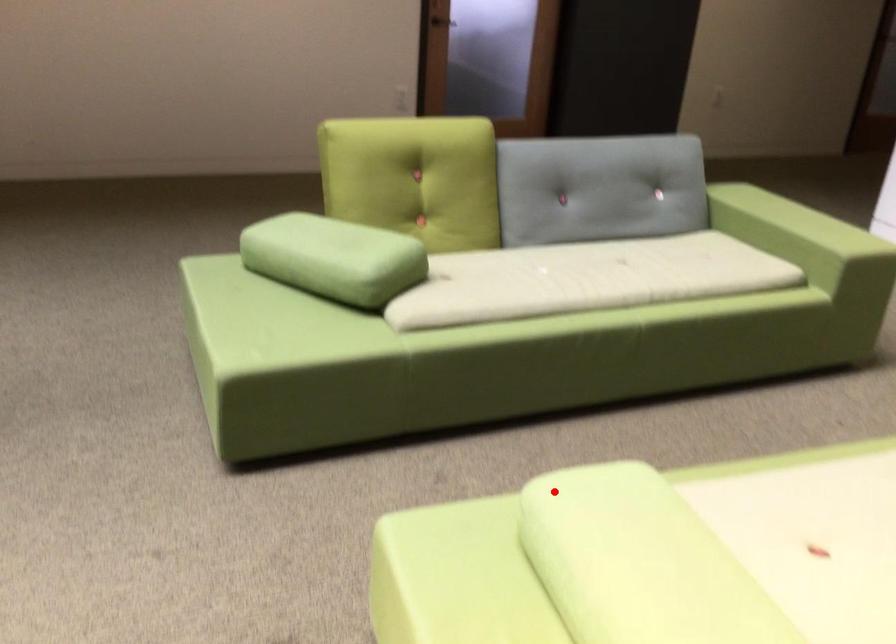
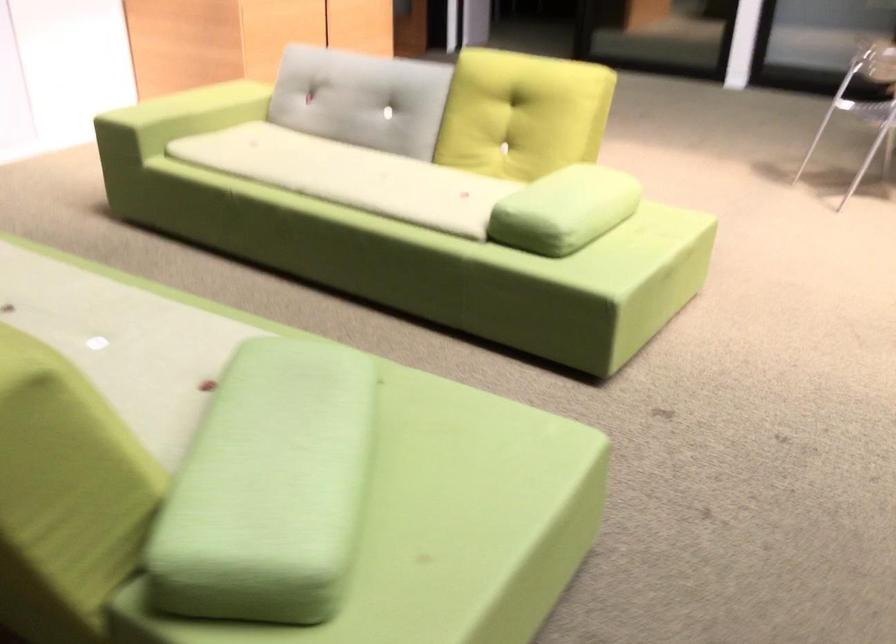
Question: I am providing you with two images of the same scene from different viewpoints. In image1, a red point is highlighted. Considering the same 3D point in image2, which of the following is correct?

Choices:
 (A) It is closer
 (B) It is farther

Answer: (B)